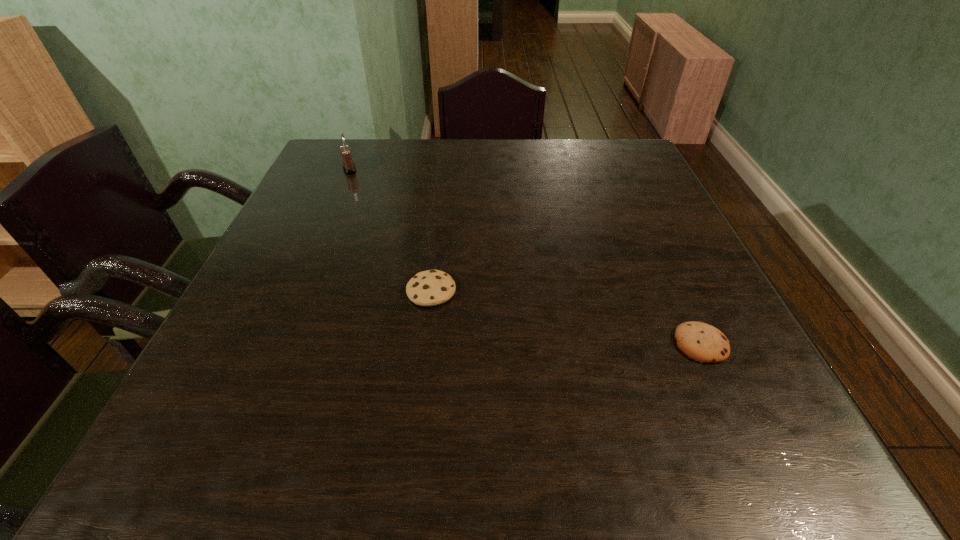
Where is `object present at the left edge`? object present at the left edge is located at coordinates (349, 167).

You are a GUI agent. You are given a task and a screenshot of the screen. Output one action in this format:
    pyautogui.click(x=<x>, y=<y>)
    Task: Click on the object located at the right edge
    The height and width of the screenshot is (540, 960).
    Given the screenshot: What is the action you would take?
    pyautogui.click(x=702, y=342)

The width and height of the screenshot is (960, 540). I want to click on object positioned at the far left corner, so click(349, 167).

The image size is (960, 540). I want to click on vacant space at the far edge, so click(x=472, y=175).

The width and height of the screenshot is (960, 540). I want to click on vacant point at the left edge, so click(x=323, y=278).

The width and height of the screenshot is (960, 540). Find the location of `vacant space at the right edge`. vacant space at the right edge is located at coordinates (650, 182).

At what (x,y) coordinates should I click in order to perform the action: click on blank space at the far left corner. Please return your answer as a coordinate pair (x, y). The width and height of the screenshot is (960, 540). Looking at the image, I should click on (328, 177).

This screenshot has height=540, width=960. Find the location of `free space at the far right corner of the desktop`. free space at the far right corner of the desktop is located at coordinates (636, 150).

The width and height of the screenshot is (960, 540). What are the coordinates of `vacant region between the second farthest object and the padlock` in the screenshot? It's located at (391, 230).

The width and height of the screenshot is (960, 540). What are the coordinates of `free space between the tallest object and the farther cookie` in the screenshot? It's located at (391, 230).